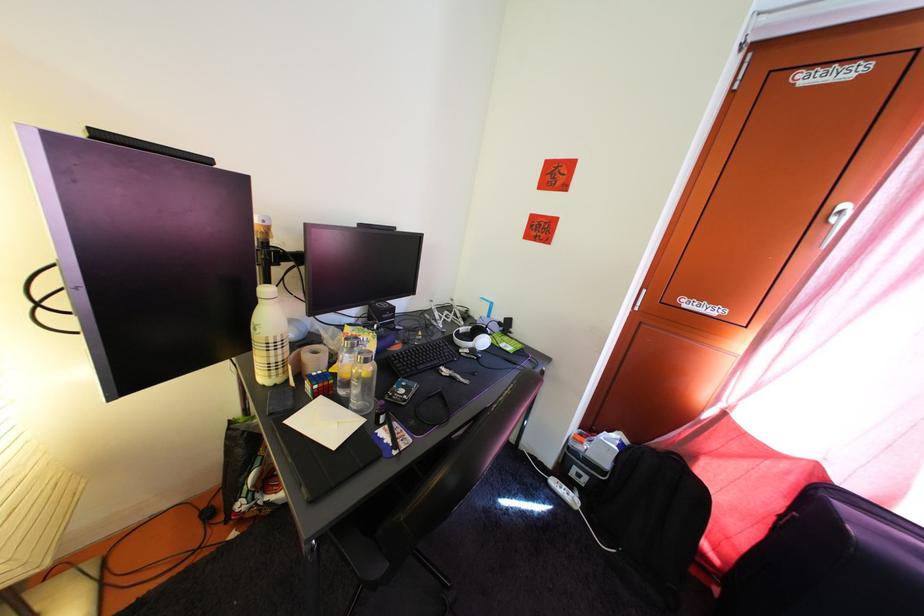
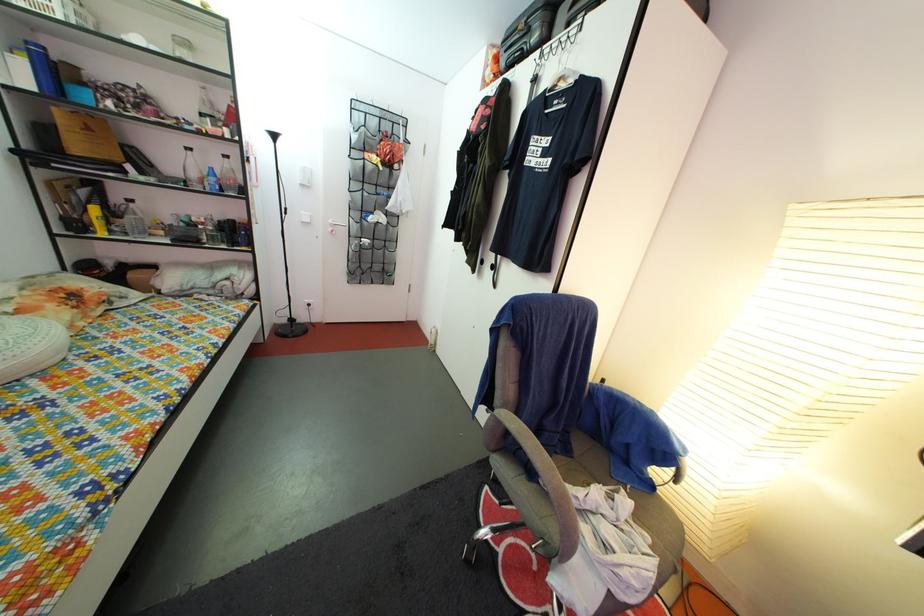
Question: How did the camera likely rotate?

Choices:
 (A) Left
 (B) Right
 (C) Up
 (D) Down

Answer: (A)